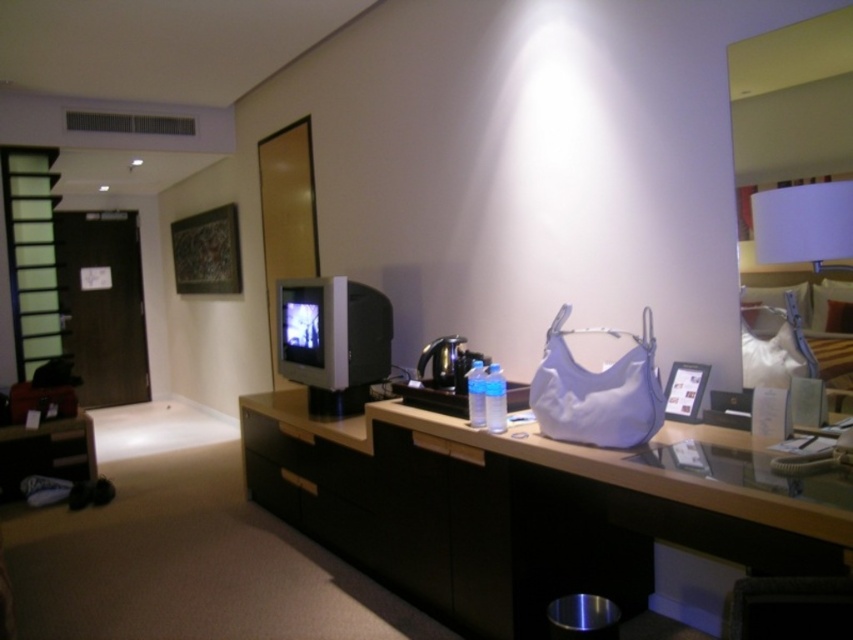
Question: Considering the real-world distances, which object is closest to the black matte drawer at center?

Choices:
 (A) matte black counter top at center
 (B) white fabric pillow at right
 (C) white matte lampshade at upper right

Answer: (A)

Question: Which of the following is the farthest from the observer?

Choices:
 (A) pyautogui.click(x=366, y=557)
 (B) pyautogui.click(x=839, y=182)
 (C) pyautogui.click(x=764, y=301)
 (D) pyautogui.click(x=302, y=458)

Answer: (D)

Question: Which of the following is the closest to the observer?

Choices:
 (A) black matte drawer at center
 (B) white matte lampshade at upper right
 (C) matte black counter top at center

Answer: (C)

Question: Is white matte lampshade at upper right smaller than black matte drawer at center?

Choices:
 (A) yes
 (B) no

Answer: (A)

Question: Is matte black counter top at center above white matte lampshade at upper right?

Choices:
 (A) yes
 (B) no

Answer: (B)

Question: Is white matte lampshade at upper right smaller than black matte drawer at center?

Choices:
 (A) no
 (B) yes

Answer: (B)